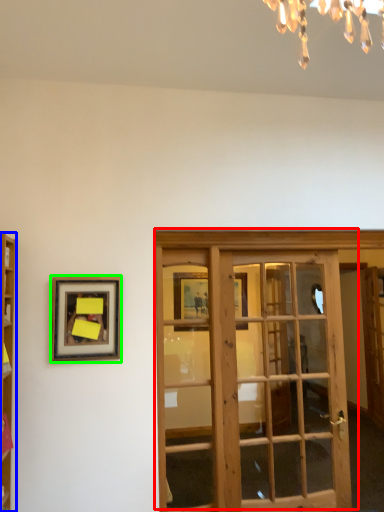
Question: Which object is the farthest from door (highlighted by a red box)? Choose among these: cabinetry (highlighted by a blue box) or picture frame (highlighted by a green box).

Choices:
 (A) cabinetry
 (B) picture frame

Answer: (A)